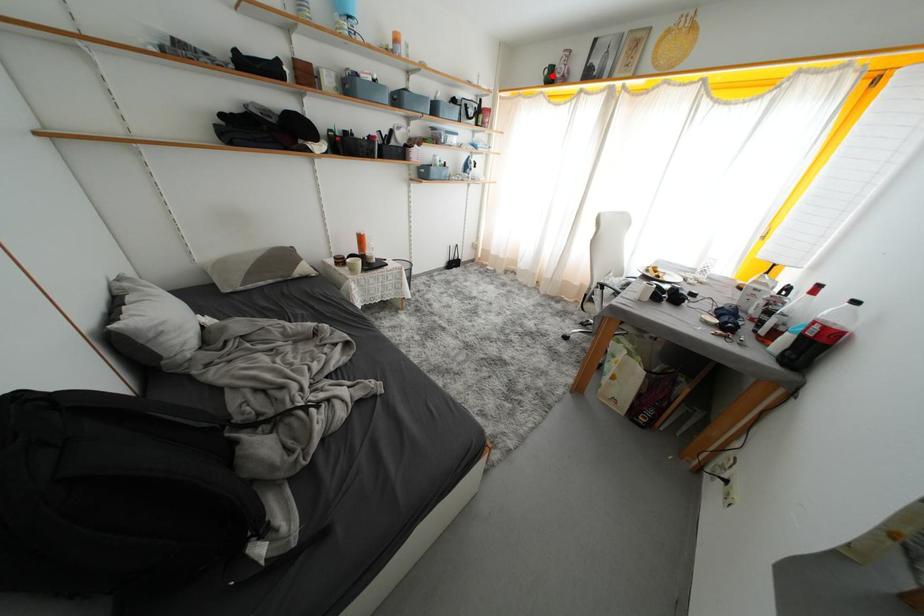
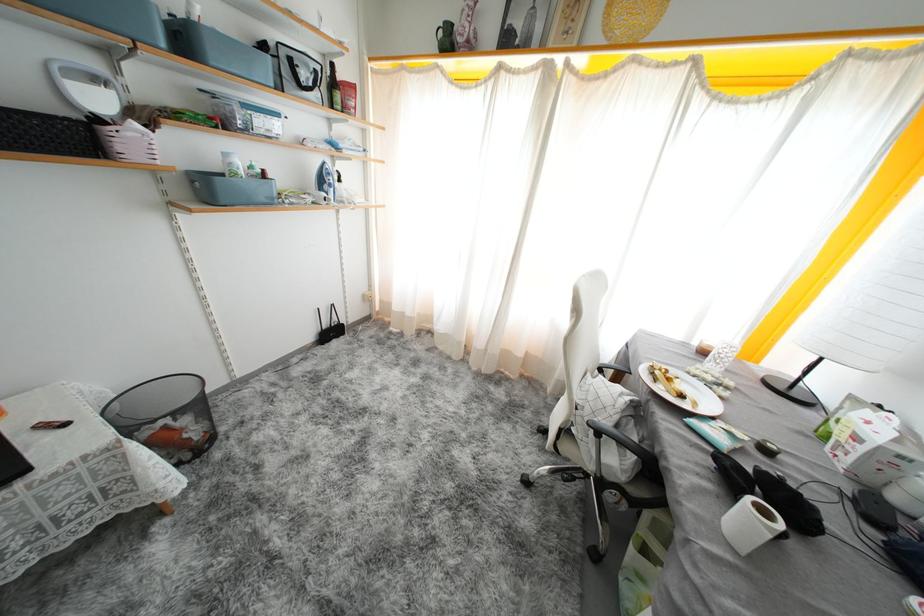
Question: I am providing you with two images of the same scene from different viewpoints. In image1, a red point is highlighted. Considering the same 3D point in image2, which of the following is correct?

Choices:
 (A) It is closer
 (B) It is farther

Answer: (B)